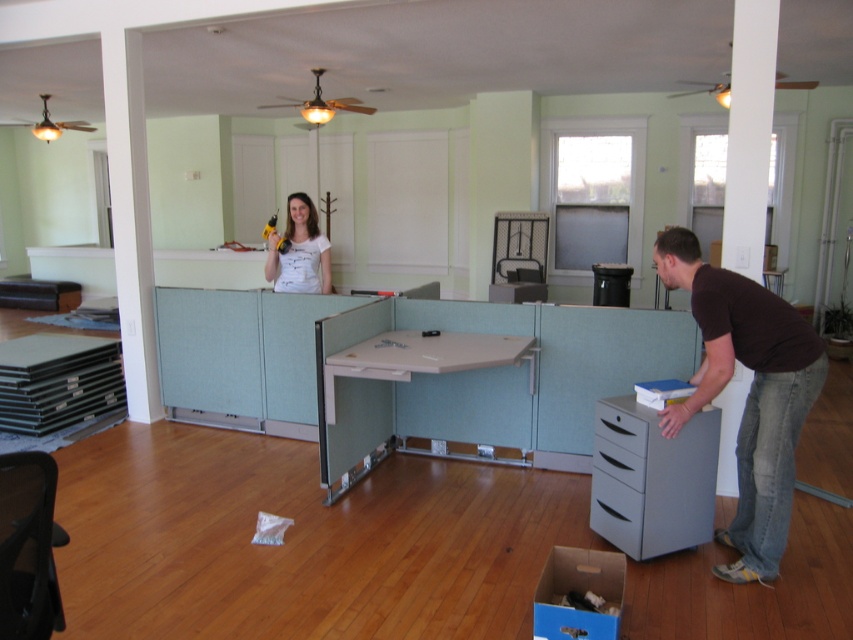
Based on the photo, can you confirm if gray matte file cabinet at lower right is wider than blue cardboard box at lower center?

Yes, gray matte file cabinet at lower right is wider than blue cardboard box at lower center.

Does point (601, 422) lie in front of point (541, 620)?

No.

The height and width of the screenshot is (640, 853). Identify the location of gray matte file cabinet at lower right. (653, 480).

Which is below, gray matte file cabinet at lower right or matte white shirt at upper center?

Positioned lower is gray matte file cabinet at lower right.

Which of these two, gray matte file cabinet at lower right or matte white shirt at upper center, stands shorter?

With less height is matte white shirt at upper center.

Identify the location of gray matte file cabinet at lower right. (653, 480).

Looking at this image, who is shorter, brown cotton shirt at right or matte gray drawer at lower right?

matte gray drawer at lower right is shorter.

Can you confirm if brown cotton shirt at right is positioned below matte gray drawer at lower right?

Incorrect, brown cotton shirt at right is not positioned below matte gray drawer at lower right.

The height and width of the screenshot is (640, 853). Describe the element at coordinates (747, 394) in the screenshot. I see `brown cotton shirt at right` at that location.

Find the location of a particular element. Image resolution: width=853 pixels, height=640 pixels. brown cotton shirt at right is located at coordinates (747, 394).